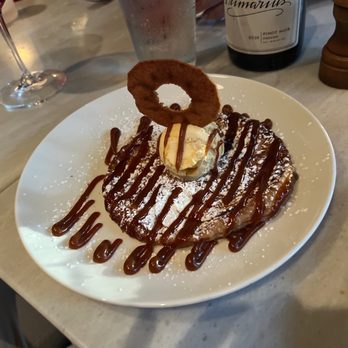
Where is `wine bottle`? wine bottle is located at coordinates (264, 63).